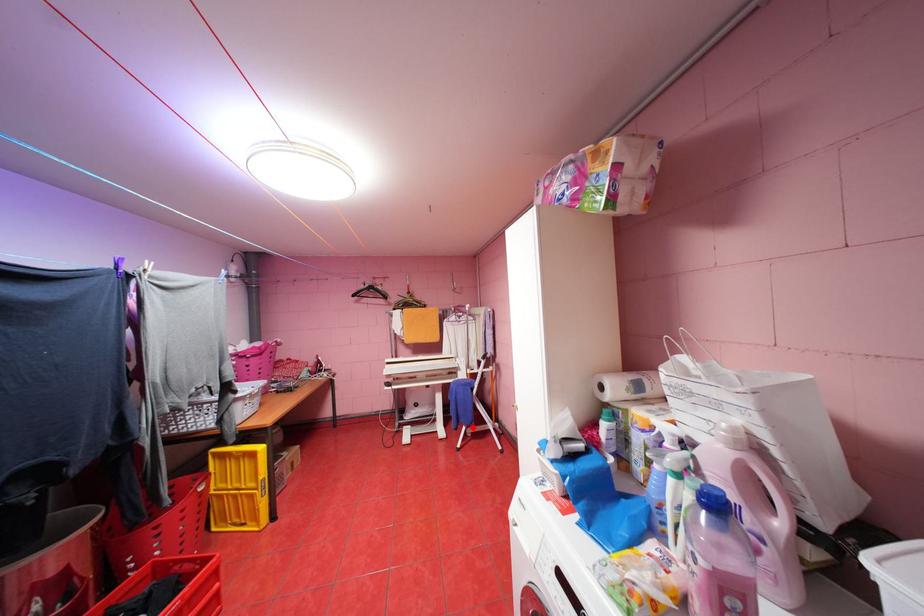
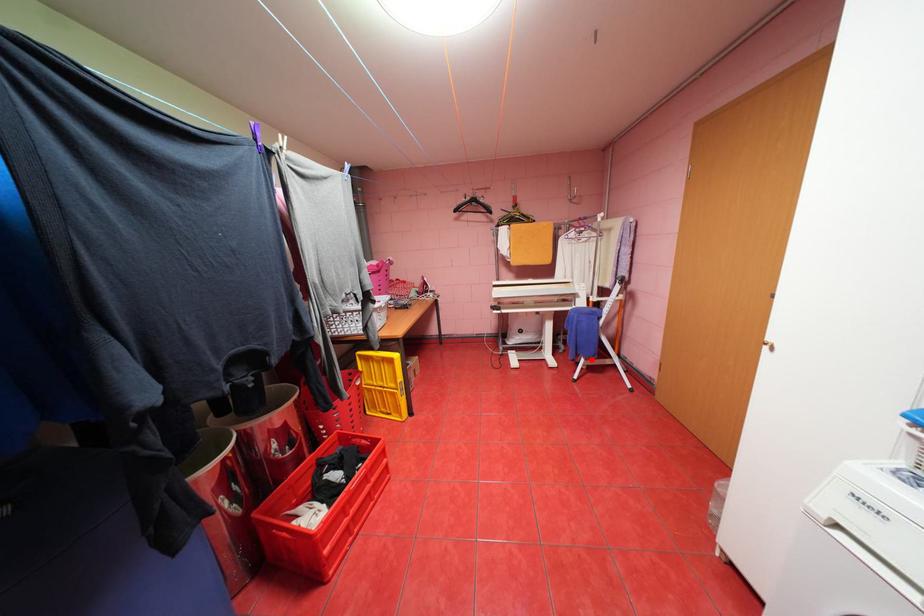
I am providing you with two images of the same scene from different viewpoints. A red point is marked on the first image and another point is marked on the second image. Is the marked point in image1 the same physical position as the marked point in image2?

Yes